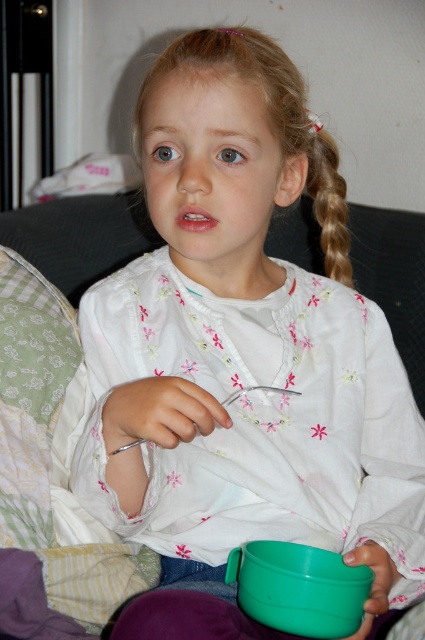
Is green plastic bowl at lower center below blonde hair at upper right?

Indeed, green plastic bowl at lower center is positioned under blonde hair at upper right.

Is green plastic bowl at lower center bigger than blonde hair at upper right?

No.

Find the location of `green plastic bowl at lower center`. green plastic bowl at lower center is located at coordinates tap(299, 588).